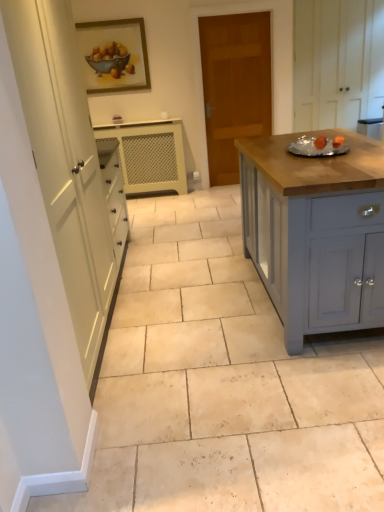
Question: In which direction should I rotate to look at white textured cabinet at center, which is the second cabinetry from top to bottom?

Choices:
 (A) left
 (B) right

Answer: (A)

Question: Is matte gray cabinet at right, which appears as the third cabinetry when viewed from the top, located within wooden door at center?

Choices:
 (A) yes
 (B) no

Answer: (B)

Question: Does wooden door at center have a lesser width compared to matte gray cabinet at right, arranged as the third cabinetry when viewed from the back?

Choices:
 (A) yes
 (B) no

Answer: (A)

Question: Can you confirm if wooden door at center is bigger than matte gray cabinet at right, arranged as the third cabinetry when viewed from the back?

Choices:
 (A) no
 (B) yes

Answer: (A)

Question: Does wooden door at center appear on the left side of matte gray cabinet at right, arranged as the third cabinetry when viewed from the back?

Choices:
 (A) no
 (B) yes

Answer: (B)

Question: Are wooden door at center and matte gray cabinet at right, arranged as the third cabinetry when viewed from the back, far apart?

Choices:
 (A) no
 (B) yes

Answer: (B)

Question: Can you confirm if wooden door at center is wider than matte gray cabinet at right, arranged as the third cabinetry when viewed from the back?

Choices:
 (A) no
 (B) yes

Answer: (A)

Question: Does white wood cabinet at upper right, which is counted as the first cabinetry, starting from the right, lie in front of wooden framed painting at upper center?

Choices:
 (A) yes
 (B) no

Answer: (B)

Question: Considering the relative sizes of white wood cabinet at upper right, the third cabinetry positioned from the left, and wooden framed painting at upper center in the image provided, is white wood cabinet at upper right, the third cabinetry positioned from the left, shorter than wooden framed painting at upper center?

Choices:
 (A) yes
 (B) no

Answer: (B)

Question: Is white wood cabinet at upper right, the third cabinetry positioned from the left, facing towards wooden framed painting at upper center?

Choices:
 (A) yes
 (B) no

Answer: (B)

Question: Is white wood cabinet at upper right, the 2th cabinetry in the front-to-back sequence, at the right side of wooden framed painting at upper center?

Choices:
 (A) yes
 (B) no

Answer: (A)

Question: From the image's perspective, does white wood cabinet at upper right, which is counted as the first cabinetry, starting from the right, appear lower than wooden framed painting at upper center?

Choices:
 (A) no
 (B) yes

Answer: (A)

Question: Considering the relative sizes of white wood cabinet at upper right, the third cabinetry ordered from the bottom, and wooden framed painting at upper center in the image provided, is white wood cabinet at upper right, the third cabinetry ordered from the bottom, thinner than wooden framed painting at upper center?

Choices:
 (A) yes
 (B) no

Answer: (B)

Question: Does white textured cabinet at center, which is counted as the 3th cabinetry, starting from the right, come in front of matte gray cabinet at right, the 1th cabinetry when ordered from front to back?

Choices:
 (A) yes
 (B) no

Answer: (B)